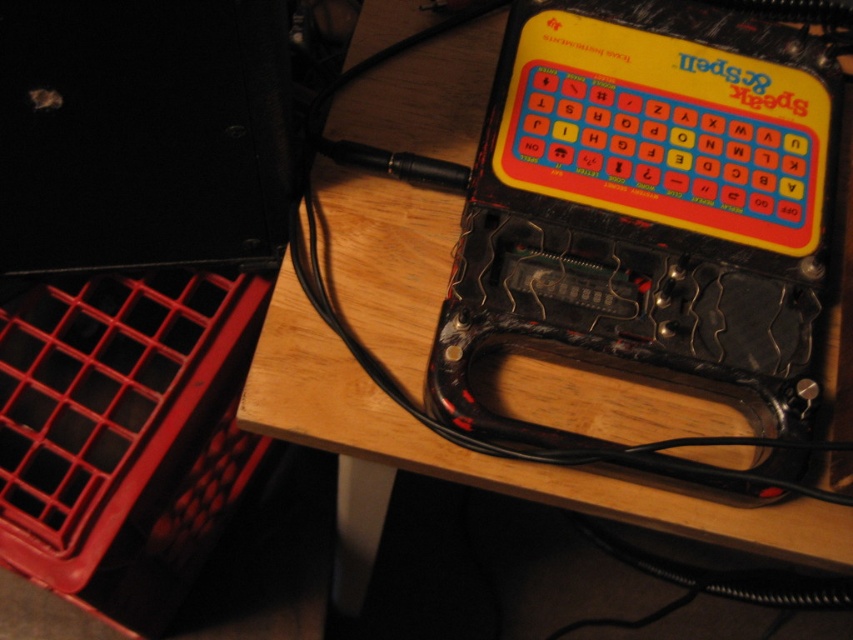
Question: Is the position of wooden table at upper center less distant than that of red plastic crate at lower left?

Choices:
 (A) yes
 (B) no

Answer: (A)

Question: Which of the following is the farthest from the observer?

Choices:
 (A) (386, 348)
 (B) (3, 513)

Answer: (B)

Question: Is wooden table at upper center thinner than red plastic crate at lower left?

Choices:
 (A) yes
 (B) no

Answer: (B)

Question: Does wooden table at upper center have a lesser width compared to red plastic crate at lower left?

Choices:
 (A) no
 (B) yes

Answer: (A)

Question: Which point appears farthest from the camera in this image?

Choices:
 (A) (584, 404)
 (B) (1, 307)

Answer: (B)